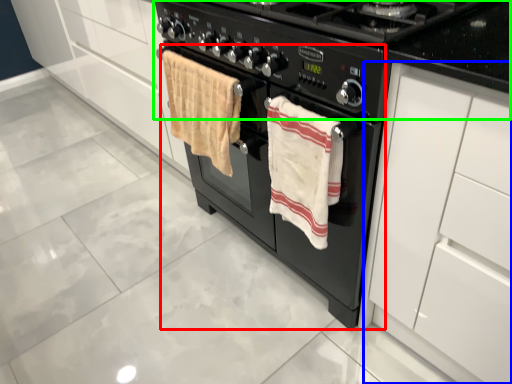
Question: Considering the real-world distances, which object is closest to oven (highlighted by a red box)? cabinetry (highlighted by a blue box) or gas stove (highlighted by a green box).

Choices:
 (A) cabinetry
 (B) gas stove

Answer: (B)